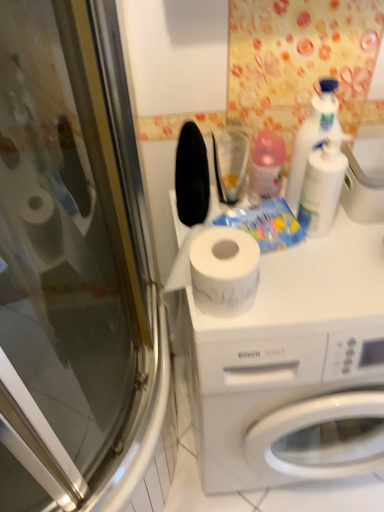
You are a GUI agent. You are given a task and a screenshot of the screen. Output one action in this format:
    pyautogui.click(x=<x>, y=<y>)
    Task: Click on the free space in front of pink plastic bottle at upper center, the third cleaning product when ordered from right to left
    
    Given the screenshot: What is the action you would take?
    pyautogui.click(x=314, y=262)